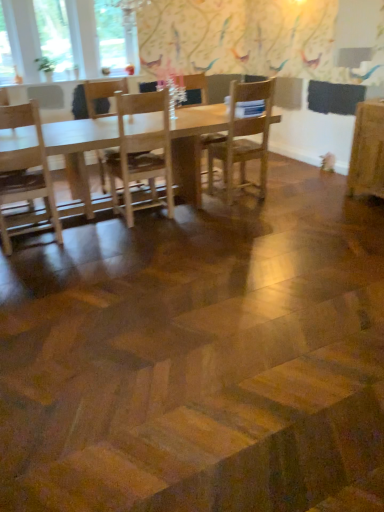
What is the approximate width of light wood table at center?

1.01 meters.

Identify the location of wooden chair at center, the 2th chair viewed from the right. The image size is (384, 512). (196, 87).

Image resolution: width=384 pixels, height=512 pixels. Describe the element at coordinates (102, 95) in the screenshot. I see `wooden chair at center, the 1th chair viewed from the left` at that location.

Measure the distance between point (264, 99) and camera.

They are 4.18 meters apart.

This screenshot has width=384, height=512. Describe the element at coordinates (117, 34) in the screenshot. I see `clear glass window at upper left, which is the first window from right to left` at that location.

At what (x,y) coordinates should I click in order to perform the action: click on clear glass window at upper left, the second window positioned from the left. Please return your answer as a coordinate pair (x, y). Looking at the image, I should click on (55, 36).

Locate an element on the screen. white glass window at upper left, marked as the 1th window in a left-to-right arrangement is located at coordinates (9, 46).

Find the location of a particular element. The width and height of the screenshot is (384, 512). light wood table at center is located at coordinates (193, 146).

How much distance is there between light wood table at center and wooden chair at center, the 1th chair viewed from the left?

The distance of light wood table at center from wooden chair at center, the 1th chair viewed from the left, is 31.52 inches.

Considering the sizes of objects light wood table at center and wooden chair at center, which is the 3th chair in right-to-left order, in the image provided, who is taller, light wood table at center or wooden chair at center, which is the 3th chair in right-to-left order,?

wooden chair at center, which is the 3th chair in right-to-left order, is taller.

Would you say light wood table at center is to the left or to the right of wooden chair at center, which is the 3th chair in right-to-left order, in the picture?

In the image, light wood table at center appears on the right side of wooden chair at center, which is the 3th chair in right-to-left order.

Who is bigger, light wood table at center or wooden chair at center, the 1th chair viewed from the left?

Bigger between the two is light wood table at center.

Which of these two, wooden chair at center, the second chair viewed from the left, or light wood table at center, is wider?

With larger width is light wood table at center.

Could light wood table at center be considered to be inside wooden chair at center, the second chair viewed from the left?

Definitely not — light wood table at center is not inside wooden chair at center, the second chair viewed from the left.

What's the angular difference between wooden chair at center, the second chair viewed from the left, and light wood table at center's facing directions?

5.11 degrees separate the facing orientations of wooden chair at center, the second chair viewed from the left, and light wood table at center.

Does point (210, 141) lie in front of point (16, 141)?

No, it is behind (16, 141).

From a real-world perspective, between white glass window at upper left, marked as the 1th window in a left-to-right arrangement, and wooden chair at center, which appears as the third chair when viewed from the left, who is vertically lower?

wooden chair at center, which appears as the third chair when viewed from the left, is physically lower.

Considering the relative positions of white glass window at upper left, marked as the 1th window in a left-to-right arrangement, and wooden chair at center, which appears as the third chair when viewed from the left, in the image provided, is white glass window at upper left, marked as the 1th window in a left-to-right arrangement, to the left of wooden chair at center, which appears as the third chair when viewed from the left, from the viewer's perspective?

Indeed, white glass window at upper left, marked as the 1th window in a left-to-right arrangement, is positioned on the left side of wooden chair at center, which appears as the third chair when viewed from the left.

From the image's perspective, relative to wooden chair at center, which appears as the third chair when viewed from the left, is white glass window at upper left, marked as the 1th window in a left-to-right arrangement, above or below?

From the image's perspective, white glass window at upper left, marked as the 1th window in a left-to-right arrangement, appears above wooden chair at center, which appears as the third chair when viewed from the left.

Does white glass window at upper left, which is counted as the third window, starting from the right, have a greater width compared to wooden chair at center, which appears as the third chair when viewed from the left?

No, white glass window at upper left, which is counted as the third window, starting from the right, is not wider than wooden chair at center, which appears as the third chair when viewed from the left.

Could you tell me if light wood table at center is facing wooden chair at center, the first chair viewed from the right?

Yes.

Does light wood table at center have a smaller size compared to wooden chair at center, the first chair viewed from the right?

No, light wood table at center is not smaller than wooden chair at center, the first chair viewed from the right.

From the image's perspective, does light wood table at center appear lower than wooden chair at center, the first chair viewed from the right?

Yes.

Is light wood table at center closer to camera compared to wooden chair at center, the first chair viewed from the right?

That is True.

From the wooden chair at center, the second chair viewed from the left, count the 2nd window to the left and point to it. Please provide its 2D coordinates.

[(55, 36)]

Is clear glass window at upper left, acting as the second window starting from the right, placed right next to wooden chair at center, the 2th chair viewed from the right?

→ No, clear glass window at upper left, acting as the second window starting from the right, is not with wooden chair at center, the 2th chair viewed from the right.

Which of these two, clear glass window at upper left, acting as the second window starting from the right, or wooden chair at center, the second chair viewed from the left, stands shorter?

With less height is clear glass window at upper left, acting as the second window starting from the right.

Does clear glass window at upper left, acting as the second window starting from the right, turn towards wooden chair at center, the second chair viewed from the left?

No.

From the image's perspective, would you say light wood table at center is shown under clear glass window at upper left, which appears as the 3th window when viewed from the left?

Indeed, from the image's perspective, light wood table at center is shown beneath clear glass window at upper left, which appears as the 3th window when viewed from the left.

Starting from the light wood table at center, which window is the 3rd one behind? Please provide its 2D coordinates.

[(117, 34)]

Which object is closer to the camera taking this photo, light wood table at center or clear glass window at upper left, which is the first window from right to left?

light wood table at center.

Is point (30, 140) positioned behind point (120, 59)?

No, it is not.

Could you tell me if wooden chair at center, which is the 3th chair in right-to-left order, is turned towards light wood table at center?

Yes, wooden chair at center, which is the 3th chair in right-to-left order, faces towards light wood table at center.

Is wooden chair at center, the 1th chair viewed from the left, positioned in front of light wood table at center?

That is False.

Who is bigger, wooden chair at center, the 1th chair viewed from the left, or light wood table at center?

Bigger between the two is light wood table at center.

Which is more to the right, wooden chair at center, the 1th chair viewed from the left, or light wood table at center?

light wood table at center.

Find the location of `chair that is the 2nd one above the light wood table at center (from a real-world perspective)`. chair that is the 2nd one above the light wood table at center (from a real-world perspective) is located at coordinates (102, 95).

From the light wood table at center, count 1st chair to the right and point to it. Please provide its 2D coordinates.

[(196, 87)]

Which object lies nearer to the anchor point light wood table at center, clear glass window at upper left, acting as the second window starting from the right, or wooden chair at center, which appears as the third chair when viewed from the left?

wooden chair at center, which appears as the third chair when viewed from the left, lies closer to light wood table at center than the other object.

Considering their positions, is wooden chair at center, the first chair viewed from the right, positioned further to white glass window at upper left, marked as the 1th window in a left-to-right arrangement, than wooden chair at center, which is the 3th chair in right-to-left order?

wooden chair at center, the first chair viewed from the right, lies further to white glass window at upper left, marked as the 1th window in a left-to-right arrangement, than the other object.

From the image, which object appears to be nearer to light wood table at center, wooden chair at center, the 1th chair viewed from the left, or clear glass window at upper left, acting as the second window starting from the right?

wooden chair at center, the 1th chair viewed from the left, lies closer to light wood table at center than the other object.

Looking at the image, which one is located further to wooden chair at center, the first chair viewed from the right, clear glass window at upper left, which appears as the 3th window when viewed from the left, or wooden chair at center, which is the 3th chair in right-to-left order?

Based on the image, clear glass window at upper left, which appears as the 3th window when viewed from the left, appears to be further to wooden chair at center, the first chair viewed from the right.

Estimate the real-world distances between objects in this image. Which object is closer to white glass window at upper left, which is counted as the third window, starting from the right, clear glass window at upper left, which appears as the 3th window when viewed from the left, or wooden chair at center, the second chair viewed from the left?

clear glass window at upper left, which appears as the 3th window when viewed from the left.

In the scene shown: Considering their positions, is wooden chair at center, the first chair viewed from the right, positioned further to wooden chair at center, which is the 3th chair in right-to-left order, than light wood table at center?

wooden chair at center, the first chair viewed from the right, is further to wooden chair at center, which is the 3th chair in right-to-left order.

Looking at the image, which one is located further to wooden chair at center, which is the 3th chair in right-to-left order, white glass window at upper left, which is counted as the third window, starting from the right, or light wood table at center?

white glass window at upper left, which is counted as the third window, starting from the right, lies further to wooden chair at center, which is the 3th chair in right-to-left order, than the other object.

Based on their spatial positions, is wooden chair at center, which appears as the third chair when viewed from the left, or white glass window at upper left, marked as the 1th window in a left-to-right arrangement, closer to light wood table at center?

wooden chair at center, which appears as the third chair when viewed from the left.

Where is `chair between clear glass window at upper left, which is the first window from right to left, and wooden chair at center, the 1th chair viewed from the left, from top to bottom`? chair between clear glass window at upper left, which is the first window from right to left, and wooden chair at center, the 1th chair viewed from the left, from top to bottom is located at coordinates (196, 87).

The width and height of the screenshot is (384, 512). I want to click on chair between white glass window at upper left, marked as the 1th window in a left-to-right arrangement, and light wood table at center, in the horizontal direction, so click(x=102, y=95).

The width and height of the screenshot is (384, 512). I want to click on kitchen & dining room table located between wooden chair at center, which is the 3th chair in right-to-left order, and wooden chair at center, the first chair viewed from the right, in the left-right direction, so click(193, 146).

What are the coordinates of `kitchen & dining room table between white glass window at upper left, which is counted as the third window, starting from the right, and wooden chair at center, the second chair viewed from the left, in the horizontal direction` in the screenshot? It's located at (193, 146).